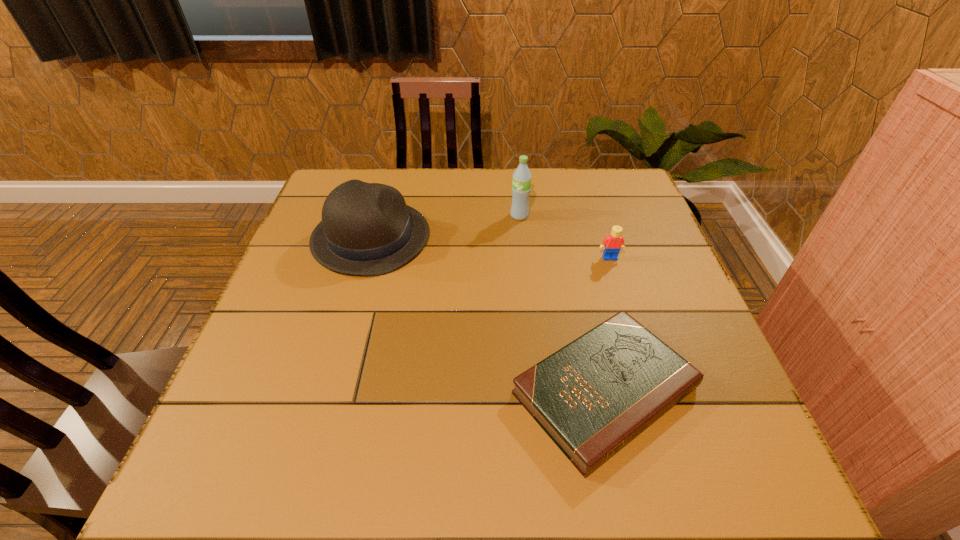
The height and width of the screenshot is (540, 960). Find the location of `water bottle that is at the far edge`. water bottle that is at the far edge is located at coordinates (521, 185).

Image resolution: width=960 pixels, height=540 pixels. I want to click on bowler hat present at the far edge, so click(x=367, y=229).

Locate an element on the screen. object present at the near edge is located at coordinates (592, 397).

At what (x,y) coordinates should I click in order to perform the action: click on object that is positioned at the left edge. Please return your answer as a coordinate pair (x, y). The image size is (960, 540). Looking at the image, I should click on (367, 229).

Identify the location of Lego located at the right edge. (614, 242).

I want to click on Bible located in the right edge section of the desktop, so click(592, 397).

Locate an element on the screen. The image size is (960, 540). object present at the far left corner is located at coordinates (367, 229).

This screenshot has height=540, width=960. What are the coordinates of `object located at the near right corner` in the screenshot? It's located at (592, 397).

The height and width of the screenshot is (540, 960). Identify the location of vacant space at the far edge. (508, 195).

This screenshot has height=540, width=960. Find the location of `vacant area at the near edge`. vacant area at the near edge is located at coordinates (511, 470).